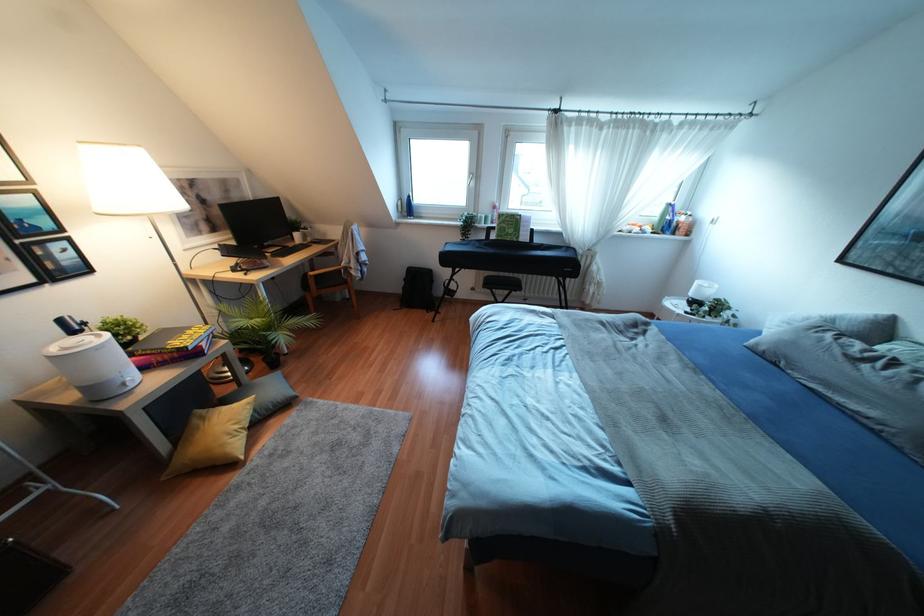
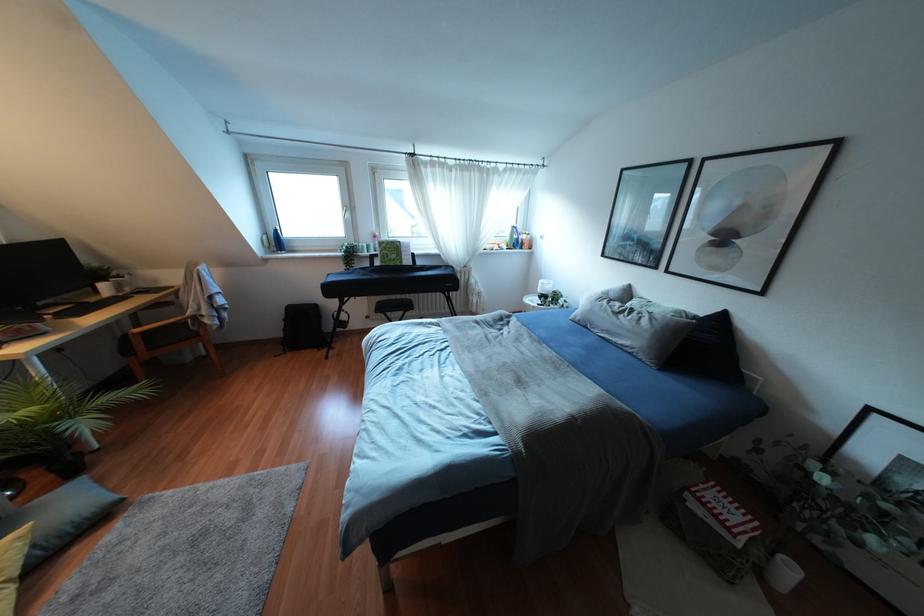
In the second image, find the point that corresponds to [504,228] in the first image.

(385, 254)